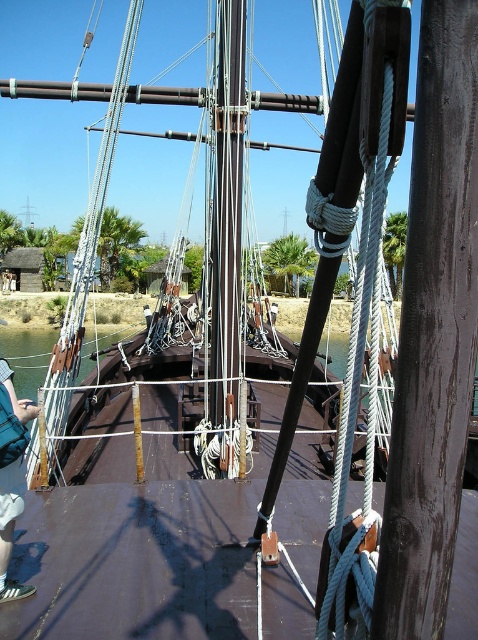
You are a sailor on the ship and need to secure a rope. You have a rope that is 1 meter wide. Can you wrap the rope around the dark brown wood at center and the blue denim shorts at lower left? Explain why based on their widths.

The dark brown wood at center is narrower than the blue denim shorts at lower left. Since the rope is 1 meter wide, it might not fit around the narrower dark brown wood at center but could potentially wrap around the wider blue denim shorts at lower left depending on their exact dimensions.

You are standing on the deck of the ship and see two points marked on the rigging ropes. The first point is at coordinates point (471, 308) and the second is at point (0, 401). Which point is closer to you when facing the ship?

Point (471, 308) is in front of point (0, 401), so the first point is closer to you when facing the ship.